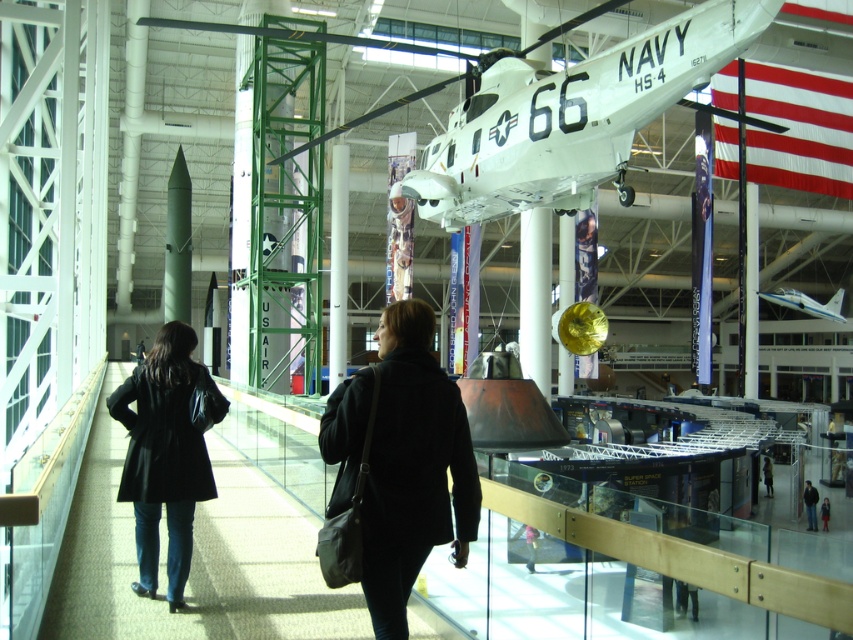
You are a visitor in the museum and you see the black fabric coat at center and the light blue plastic airplane at center. Which object is closer to the ground?

The black fabric coat at center is located below the light blue plastic airplane at center, so it is closer to the ground.

You are a visitor in the museum and see the black fabric coat at center and the light blue plastic airplane at center. Which object is positioned to the right side?

The light blue plastic airplane at center is positioned to the right of the black fabric coat at center.